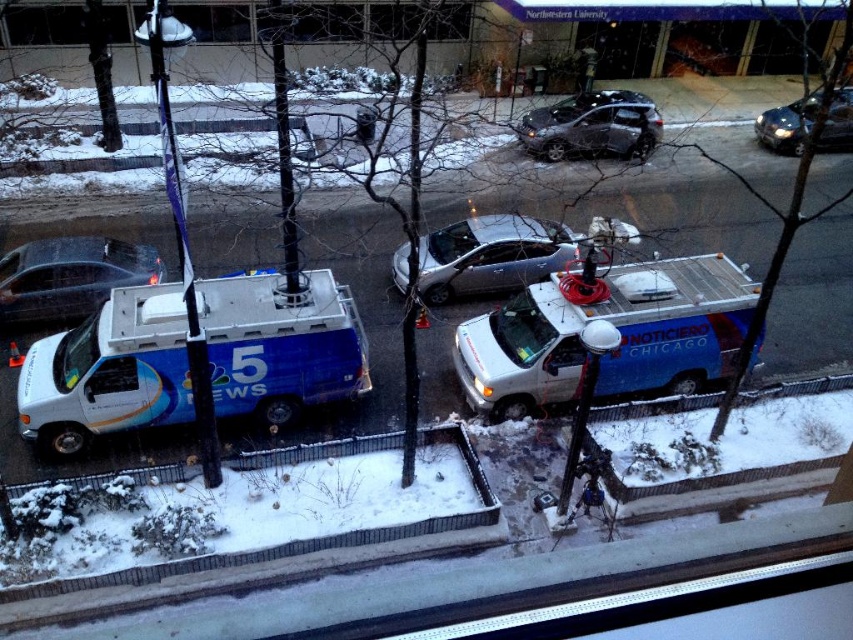
You are standing on the snowy street and want to take a photo of the white glossy van at center. If your camera has a maximum focus range of 10 meters, will you be able to capture a clear image of the van?

The white glossy van at center is 11.20 meters away from the viewer. Since the camera can only focus up to 10 meters, you won generated question and answer based on the provided information. 1. The question must be based on the given scene and objects. 2. The question must incorporate the object labels exactly as provided. 3. The answer must use the object description to provide a factual response without adding extra information. 4. The question should be phrased in a way that requires understanding the 3

In the scene shown: You are standing on the snowy street and want to take a photo of the point at coordinates (570,246). If your camera has a maximum focus range of 15 meters, will you be able to focus on that point?

The distance of point (570,246) from the viewer is 16.81 meters, which exceeds the camera maximum focus range of 15 meters. Therefore, you won not be able to focus on that point.

You are a pedestrian trying to cross the street where the white glossy van at center and the blue metallic van at center are parked. Which van do you need to look out for first as you step onto the road?

The white glossy van at center is in front of the blue metallic van at center, so you should look out for the white glossy van at center first as it is closer to your path.